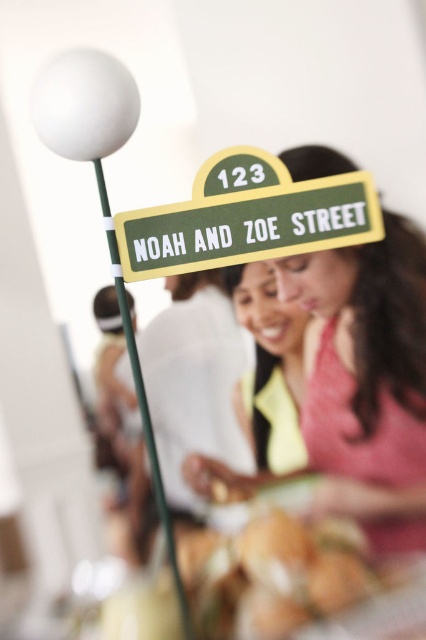
You are designing a poster for a neighborhood event and want to include both the green matte street sign at upper center and the green matte street sign at center. Which one should you choose if you need a sign with a wider width for better visibility?

The green matte street sign at upper center is wider than the green matte street sign at center, so it would be better for better visibility.

You are designing a poster for a neighborhood event and want to include both the green matte street sign at upper center and the green matte street sign at center. Which sign should you choose if you want the one that appears bigger in the image?

The green matte street sign at upper center is larger in size compared to the green matte street sign at center, so it would be the better choice for a bigger appearance on the poster.

From the picture: You are standing at the point with coordinates point (199, 234) and want to walk to the point with coordinates point (305, 385). Will you need to walk towards the background or the foreground of the image?

You will need to walk towards the background of the image because point (305, 385) is behind point (199, 234).